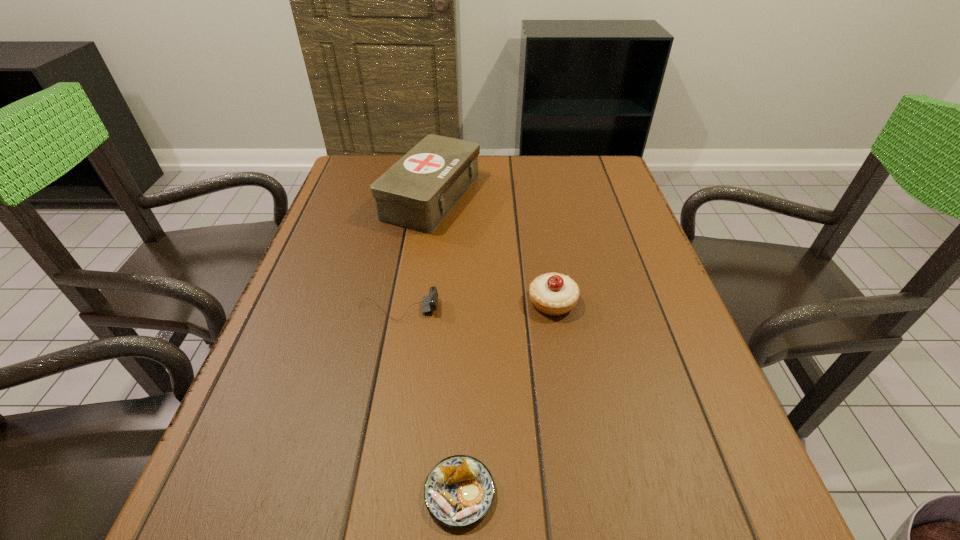
I want to click on vacant space at the far right corner of the desktop, so click(592, 181).

Image resolution: width=960 pixels, height=540 pixels. In the image, there is a desktop. In order to click on free space at the near right corner in this screenshot , I will do coord(707,515).

You are a GUI agent. You are given a task and a screenshot of the screen. Output one action in this format:
    pyautogui.click(x=<x>, y=<y>)
    Task: Click on the empty space between the left pastry and the webcam
    The width and height of the screenshot is (960, 540).
    Given the screenshot: What is the action you would take?
    pyautogui.click(x=429, y=401)

This screenshot has width=960, height=540. Identify the location of free area in between the first-aid kit and the farther pastry. (492, 249).

This screenshot has height=540, width=960. I want to click on free spot between the right pastry and the first-aid kit, so click(492, 249).

Identify the location of unoccupied area between the webcam and the left pastry. (429, 401).

Image resolution: width=960 pixels, height=540 pixels. I want to click on free spot between the left pastry and the first-aid kit, so click(x=445, y=345).

At what (x,y) coordinates should I click in order to perform the action: click on vacant space that's between the webcam and the farthest object. Please return your answer as a coordinate pair (x, y). The image size is (960, 540). Looking at the image, I should click on (415, 253).

Identify the location of vacant space that is in between the webcam and the tallest object. This screenshot has height=540, width=960. (415, 253).

Locate an element on the screen. The width and height of the screenshot is (960, 540). vacant space that is in between the left pastry and the farther pastry is located at coordinates (506, 397).